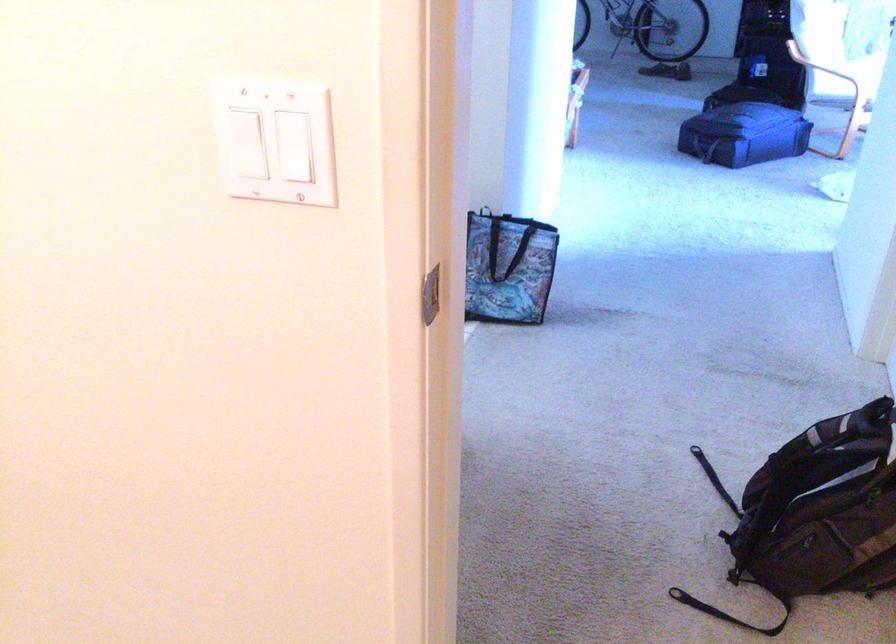
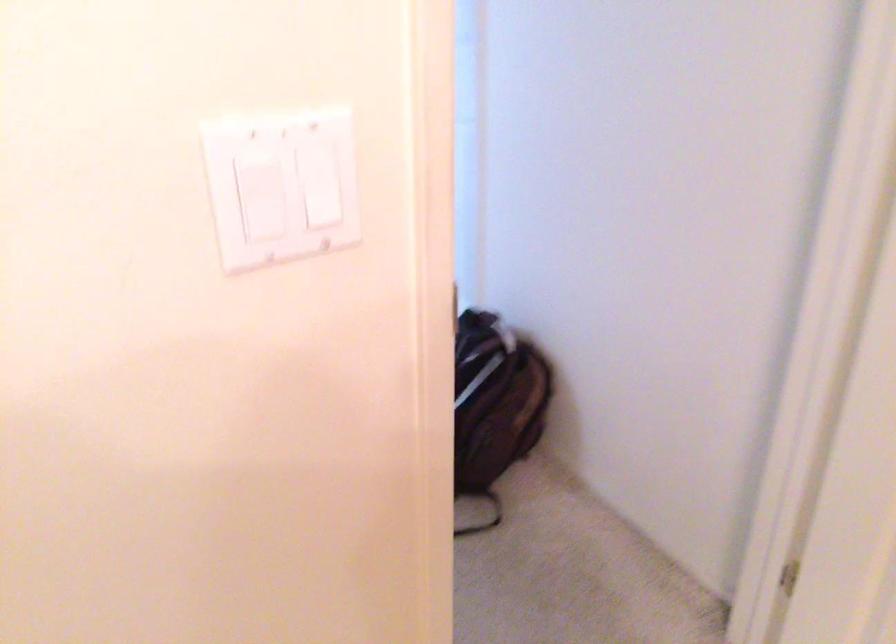
Question: The camera is either moving clockwise (left) or counter-clockwise (right) around the object. The first image is from the beginning of the video and the second image is from the end. Is the camera moving left or right when shooting the video?

Choices:
 (A) Left
 (B) Right

Answer: (A)